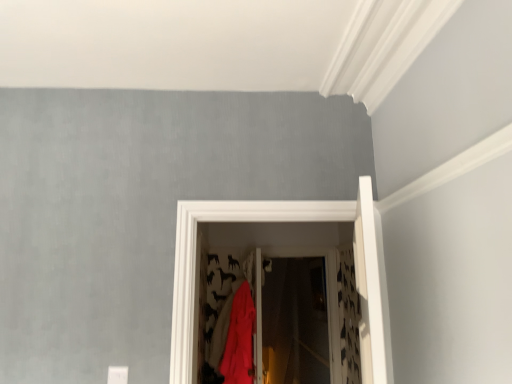
Question: From a real-world perspective, is transparent plastic screen door at center physically located above or below matte red fabric at center?

Choices:
 (A) above
 (B) below

Answer: (A)

Question: Considering the positions of point (316, 355) and point (238, 304), is point (316, 355) closer or farther from the camera than point (238, 304)?

Choices:
 (A) closer
 (B) farther

Answer: (B)

Question: Considering their positions, is transparent plastic screen door at center located in front of or behind matte red fabric at center?

Choices:
 (A) behind
 (B) front

Answer: (A)

Question: From the image's perspective, is matte red fabric at center positioned above or below transparent plastic screen door at center?

Choices:
 (A) below
 (B) above

Answer: (A)

Question: In the image, is matte red fabric at center positioned in front of or behind transparent plastic screen door at center?

Choices:
 (A) front
 (B) behind

Answer: (A)

Question: Is matte red fabric at center situated inside transparent plastic screen door at center or outside?

Choices:
 (A) inside
 (B) outside

Answer: (B)

Question: From their relative heights in the image, would you say matte red fabric at center is taller or shorter than transparent plastic screen door at center?

Choices:
 (A) short
 (B) tall

Answer: (A)